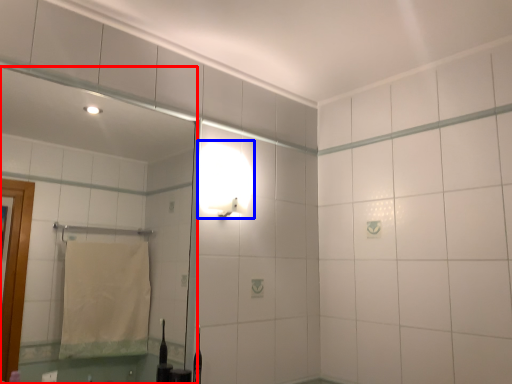
Question: Which of the following is the farthest to the observer, mirror (highlighted by a red box) or light fixture (highlighted by a blue box)?

Choices:
 (A) mirror
 (B) light fixture

Answer: (B)